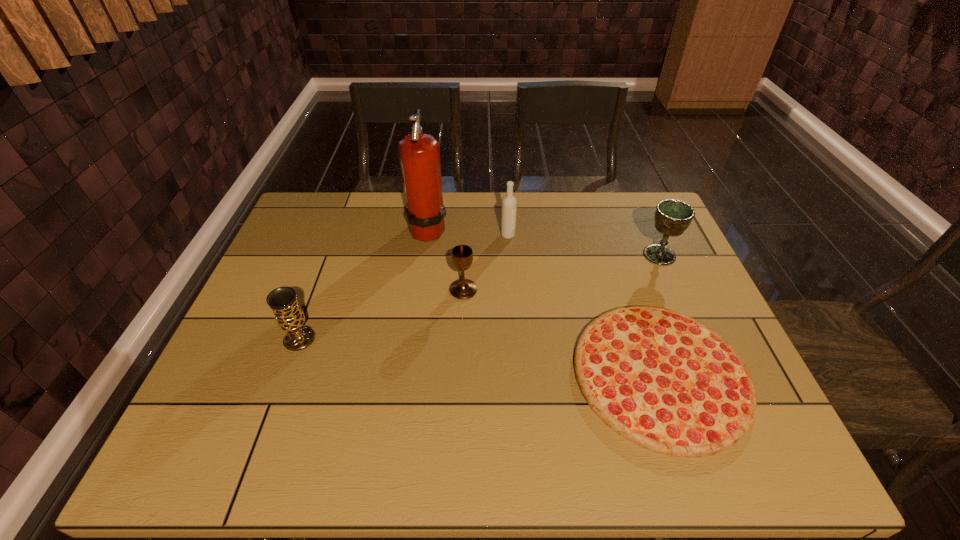
You are a GUI agent. You are given a task and a screenshot of the screen. Output one action in this format:
    pyautogui.click(x=<x>, y=<y>)
    Task: Click on the free space between the shortest object and the third nearest object
    
    Given the screenshot: What is the action you would take?
    pyautogui.click(x=562, y=332)

Where is `vacant space that's between the farthest chalice and the tallest object`? The width and height of the screenshot is (960, 540). vacant space that's between the farthest chalice and the tallest object is located at coordinates (543, 241).

Locate an element on the screen. This screenshot has width=960, height=540. free space between the vodka and the rightmost chalice is located at coordinates (584, 245).

You are a GUI agent. You are given a task and a screenshot of the screen. Output one action in this format:
    pyautogui.click(x=<x>, y=<y>)
    Task: Click on the vacant space that's between the nearest chalice and the rightmost chalice
    
    Given the screenshot: What is the action you would take?
    pyautogui.click(x=479, y=297)

Identify the location of unoccupied area between the third nearest object and the tallest object. (445, 259).

Locate an element on the screen. vacant area that lies between the fire extinguisher and the shortest object is located at coordinates (544, 301).

The image size is (960, 540). What are the coordinates of `object that is the second closest to the shortest object` in the screenshot? It's located at (461, 255).

Select which object is the closest to the pizza. Please provide its 2D coordinates. Your answer should be formatted as a tuple, i.e. [(x, y)], where the tuple contains the x and y coordinates of a point satisfying the conditions above.

[(672, 217)]

This screenshot has height=540, width=960. Find the location of `chalice identified as the closest to the third nearest object`. chalice identified as the closest to the third nearest object is located at coordinates tap(289, 316).

Image resolution: width=960 pixels, height=540 pixels. Identify the location of chalice that is the closest one to the pizza. (672, 217).